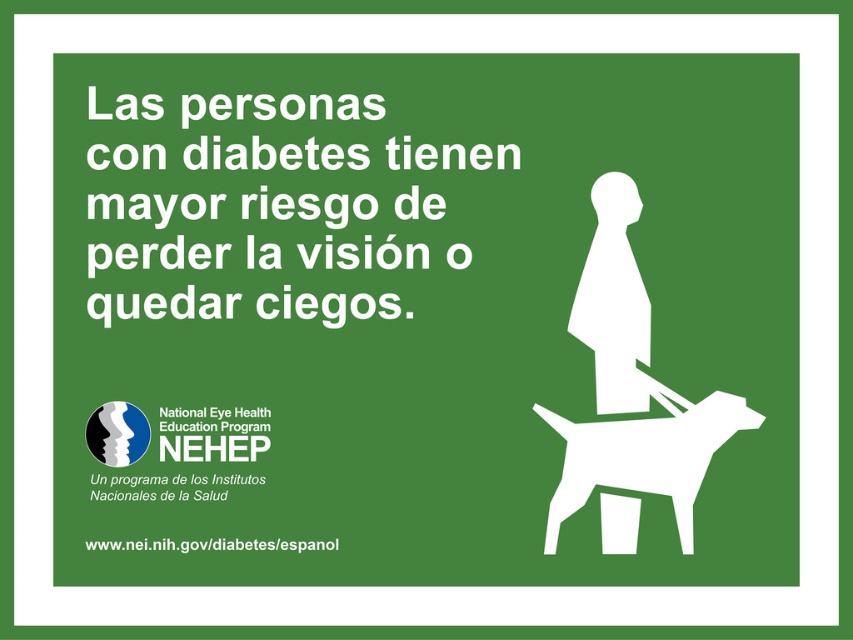
Question: Which point is closer to the camera?

Choices:
 (A) (621, 397)
 (B) (544, 541)

Answer: (B)

Question: Can you confirm if white matte dog at lower right is positioned to the left of white matte silhouette at center?

Choices:
 (A) yes
 (B) no

Answer: (B)

Question: Is white matte dog at lower right to the right of white matte silhouette at center from the viewer's perspective?

Choices:
 (A) no
 (B) yes

Answer: (B)

Question: Which point is closer to the camera?

Choices:
 (A) white matte silhouette at center
 (B) white matte dog at lower right

Answer: (B)

Question: Is white matte dog at lower right positioned in front of white matte silhouette at center?

Choices:
 (A) yes
 (B) no

Answer: (A)

Question: Which point appears farthest from the camera in this image?

Choices:
 (A) (585, 308)
 (B) (544, 547)

Answer: (A)